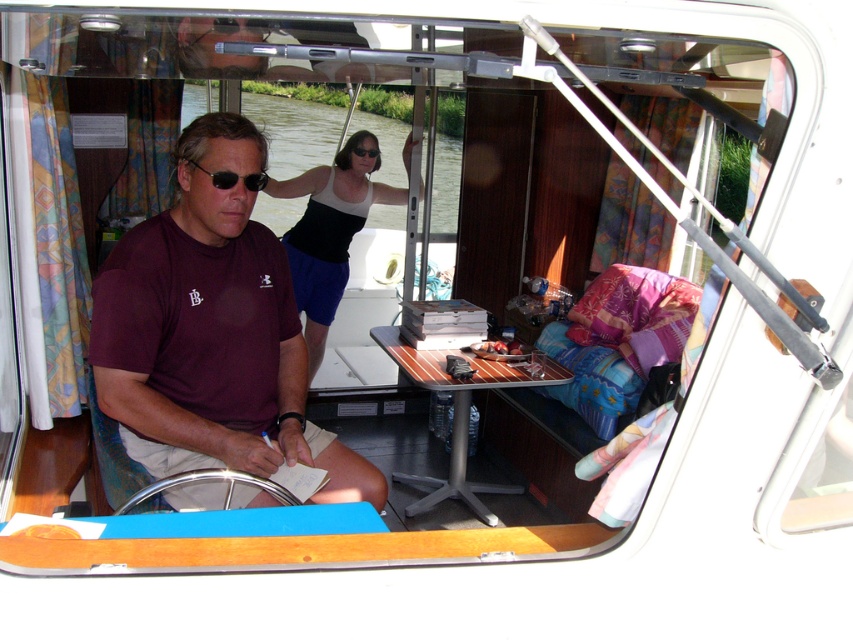
Is maroon t-shirt at center closer to camera compared to black matte sunglasses at left?

No, maroon t-shirt at center is further to the viewer.

This screenshot has height=640, width=853. I want to click on maroon t-shirt at center, so click(212, 332).

Is black matte sunglasses at left to the left of matte black sunglasses at upper center from the viewer's perspective?

Indeed, black matte sunglasses at left is positioned on the left side of matte black sunglasses at upper center.

Is black matte sunglasses at left below matte black sunglasses at upper center?

Yes, black matte sunglasses at left is below matte black sunglasses at upper center.

What do you see at coordinates (218, 177) in the screenshot? The image size is (853, 640). I see `black matte sunglasses at left` at bounding box center [218, 177].

Identify the location of black matte sunglasses at left. The image size is (853, 640). (218, 177).

Locate an element on the screen. maroon t-shirt at center is located at coordinates (212, 332).

Between maroon t-shirt at center and matte black sunglasses at upper center, which one has less height?

matte black sunglasses at upper center is shorter.

At what (x,y) coordinates should I click in order to perform the action: click on maroon t-shirt at center. Please return your answer as a coordinate pair (x, y). This screenshot has width=853, height=640. Looking at the image, I should click on (212, 332).